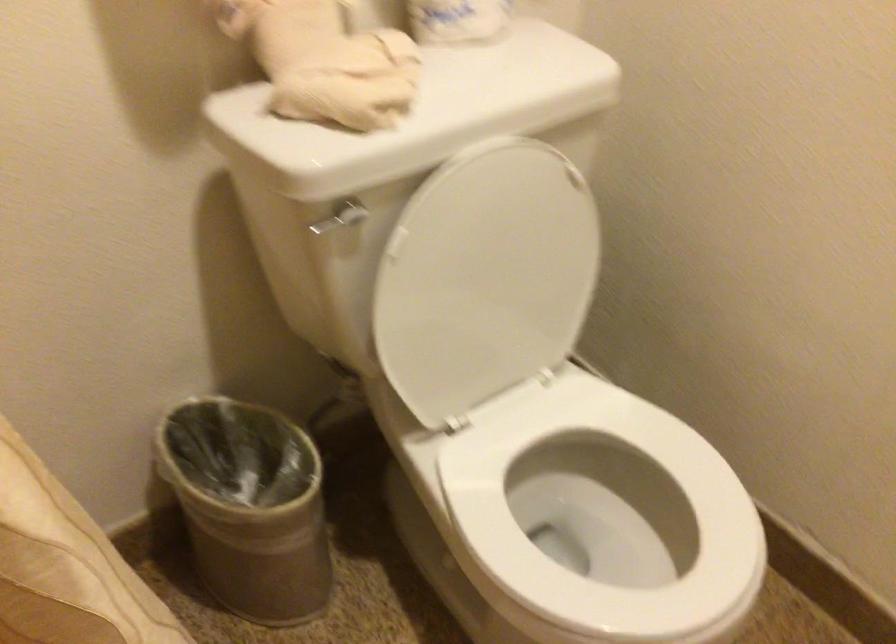
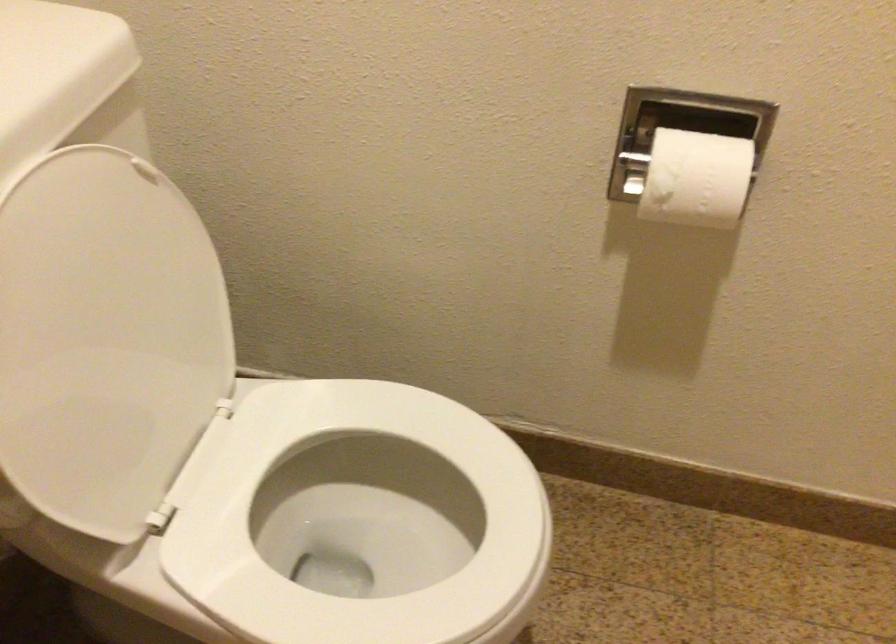
Question: The images are taken continuously from a first-person perspective. In which direction is your viewpoint rotating?

Choices:
 (A) Left
 (B) Right
 (C) Up
 (D) Down

Answer: (B)